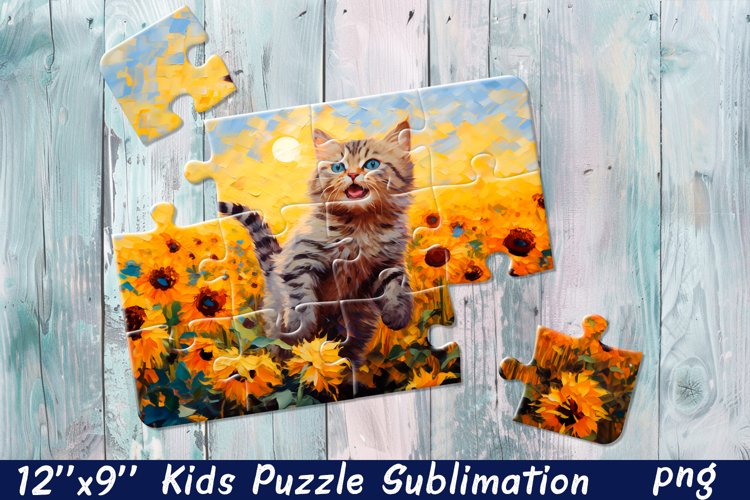
Identify the location of wooden planks behind the puzzle. Image resolution: width=750 pixels, height=500 pixels. (686, 141), (592, 61), (460, 42), (373, 56), (277, 63), (162, 170), (58, 166).